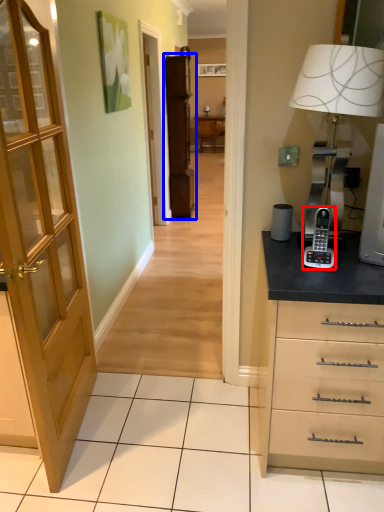
Question: Which of the following is the closest to the observer, gadget (highlighted by a red box) or file cabinet (highlighted by a blue box)?

Choices:
 (A) gadget
 (B) file cabinet

Answer: (A)